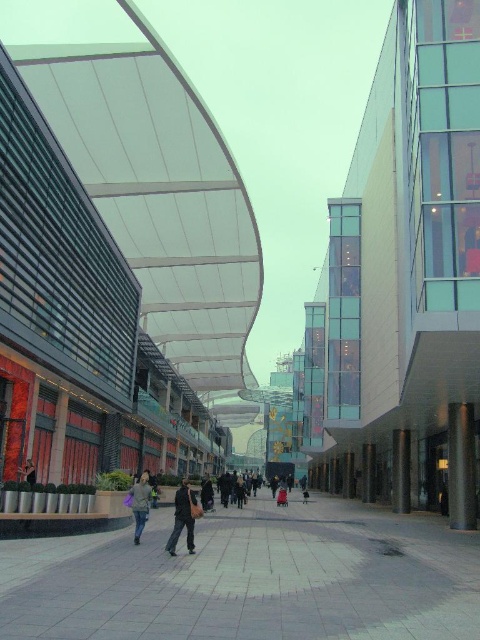
Question: Which point appears farthest from the camera in this image?

Choices:
 (A) (470, 426)
 (B) (183, 512)

Answer: (A)

Question: Which point is farther to the camera?

Choices:
 (A) dark gray fabric jacket at center
 (B) light brown fabric jacket at center
 (C) slate gray concrete pillar at center
 (D) brown stone pillar at center

Answer: (D)

Question: Estimate the real-world distances between objects in this image. Which object is farther from the dark gray fabric jacket at lower left?

Choices:
 (A) smooth concrete plaza at center
 (B) black polished pillar at center
 (C) satin silver column at right
 (D) light brown fabric jacket at center

Answer: (B)

Question: Does glassy transparent mall at right lie in front of dark gray fabric jacket at lower left?

Choices:
 (A) yes
 (B) no

Answer: (A)

Question: Can you confirm if glassy transparent mall at right is positioned below dark gray fabric jacket at lower left?

Choices:
 (A) yes
 (B) no

Answer: (B)

Question: Can you confirm if smooth concrete plaza at center is positioned to the right of satin silver column at right?

Choices:
 (A) yes
 (B) no

Answer: (B)